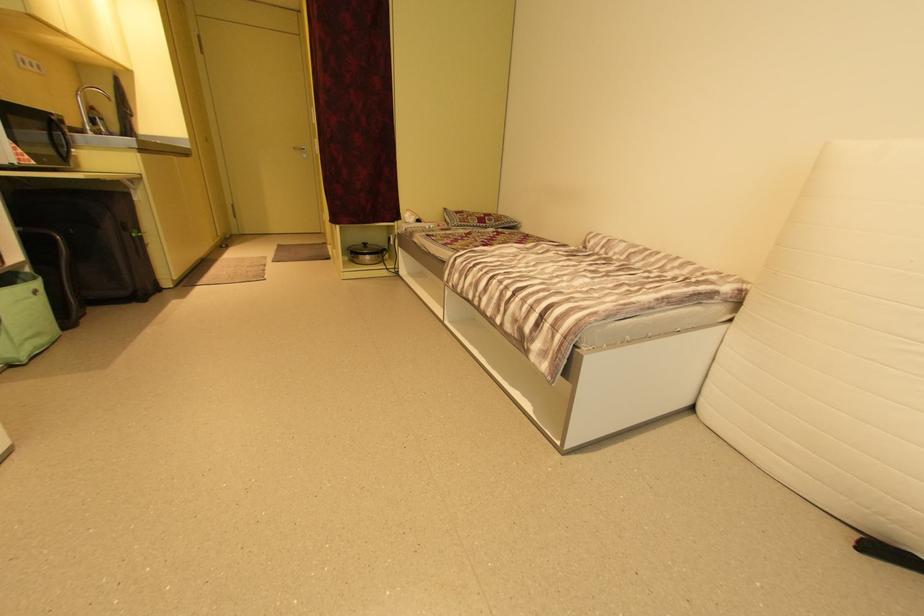
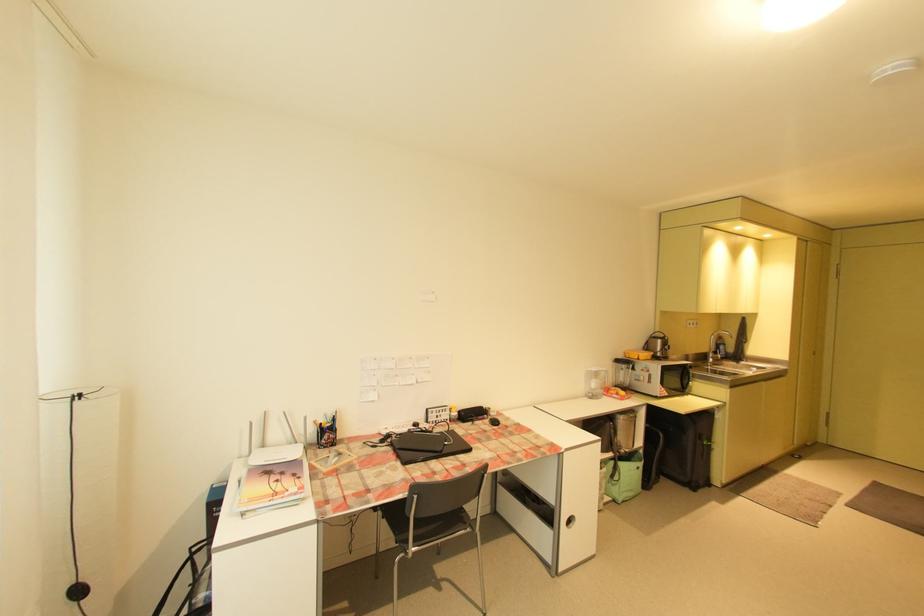
Where in the second image is the point corresponding to pixel 100 124 from the first image?

(722, 353)